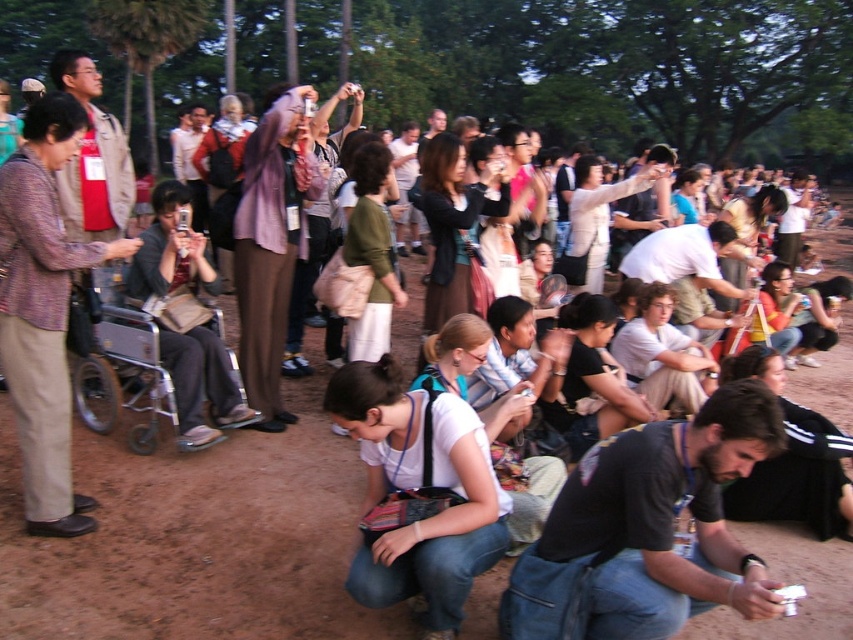
Is dark gray fabric shirt at lower right to the right of white fabric shirt at center from the viewer's perspective?

Indeed, dark gray fabric shirt at lower right is positioned on the right side of white fabric shirt at center.

Is dark gray fabric shirt at lower right positioned in front of white fabric shirt at center?

Yes, dark gray fabric shirt at lower right is closer to the viewer.

Describe the element at coordinates (648, 529) in the screenshot. This screenshot has width=853, height=640. I see `dark gray fabric shirt at lower right` at that location.

This screenshot has height=640, width=853. Identify the location of dark gray fabric shirt at lower right. (648, 529).